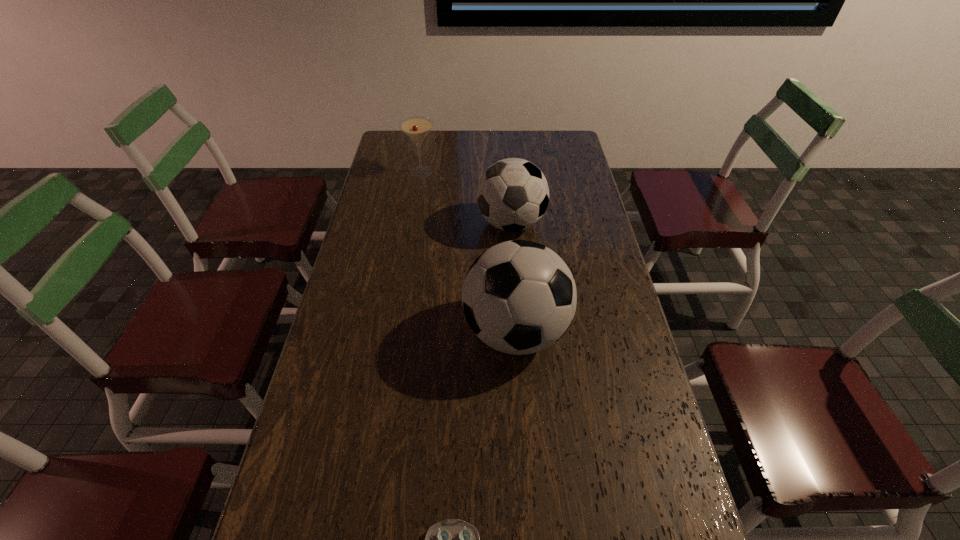
Find the location of `free point located 0.120m on the back of the leftmost object`. free point located 0.120m on the back of the leftmost object is located at coordinates (425, 148).

At what (x,y) coordinates should I click in order to perform the action: click on object situated at the left edge. Please return your answer as a coordinate pair (x, y). The height and width of the screenshot is (540, 960). Looking at the image, I should click on (416, 128).

Identify the location of blank space at the far edge of the desktop. (509, 140).

The height and width of the screenshot is (540, 960). In order to click on vacant region at the left edge in this screenshot , I will do `click(363, 251)`.

The height and width of the screenshot is (540, 960). What are the coordinates of `free space at the right edge` in the screenshot? It's located at (x=671, y=512).

The image size is (960, 540). I want to click on free space at the far right corner of the desktop, so click(571, 130).

Locate an element on the screen. free area in between the leftmost object and the taller soccer ball is located at coordinates (468, 252).

You are a GUI agent. You are given a task and a screenshot of the screen. Output one action in this format:
    pyautogui.click(x=<x>, y=<y>)
    Task: Click on the vacant area that lies between the farther soccer ball and the farthest object
    The height and width of the screenshot is (540, 960).
    Given the screenshot: What is the action you would take?
    pyautogui.click(x=467, y=198)

Locate an element on the screen. The height and width of the screenshot is (540, 960). free space between the taller soccer ball and the farthest object is located at coordinates (468, 252).

Where is `free space between the leftmost object and the third farthest object`? Image resolution: width=960 pixels, height=540 pixels. free space between the leftmost object and the third farthest object is located at coordinates [468, 252].